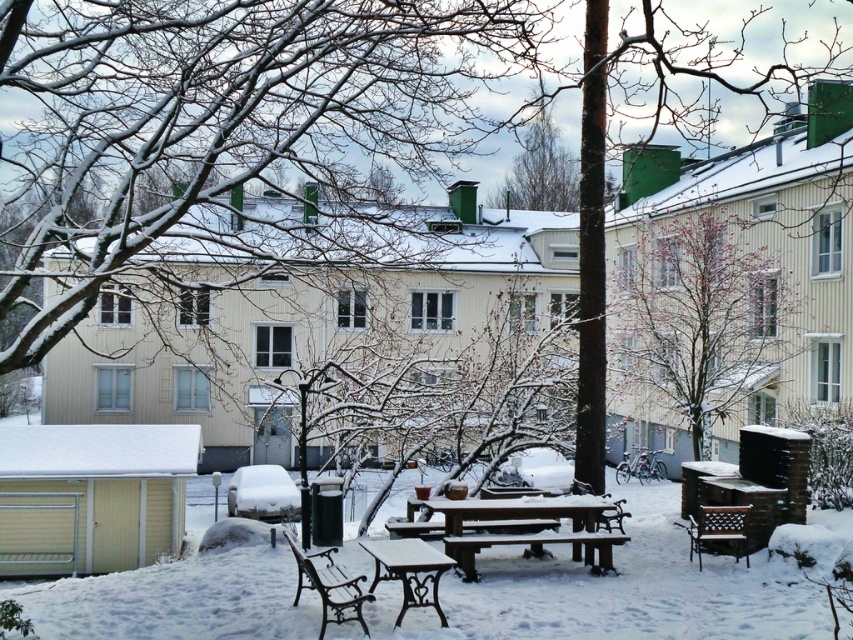
Question: Which point is closer to the camera?

Choices:
 (A) (167, 76)
 (B) (485, 625)
 (C) (598, 538)

Answer: (B)

Question: Is snow-covered branches at upper left wider than brown woven chair at lower right?

Choices:
 (A) no
 (B) yes

Answer: (B)

Question: Considering the relative positions of white powdery snow at center and wooden bench at center in the image provided, where is white powdery snow at center located with respect to wooden bench at center?

Choices:
 (A) left
 (B) right

Answer: (A)

Question: Which of the following is the closest to the observer?

Choices:
 (A) wooden bench at center
 (B) wooden picnic table at center
 (C) snow-covered branches at upper left

Answer: (C)

Question: Is bare wood tree at center further to camera compared to bronze metal bench at lower center?

Choices:
 (A) no
 (B) yes

Answer: (B)

Question: Which of these objects is positioned closest to the snow-covered branches at upper left?

Choices:
 (A) bare wood tree at center
 (B) wooden picnic table at center
 (C) white painted wood table at center
 (D) wooden bench at center

Answer: (A)